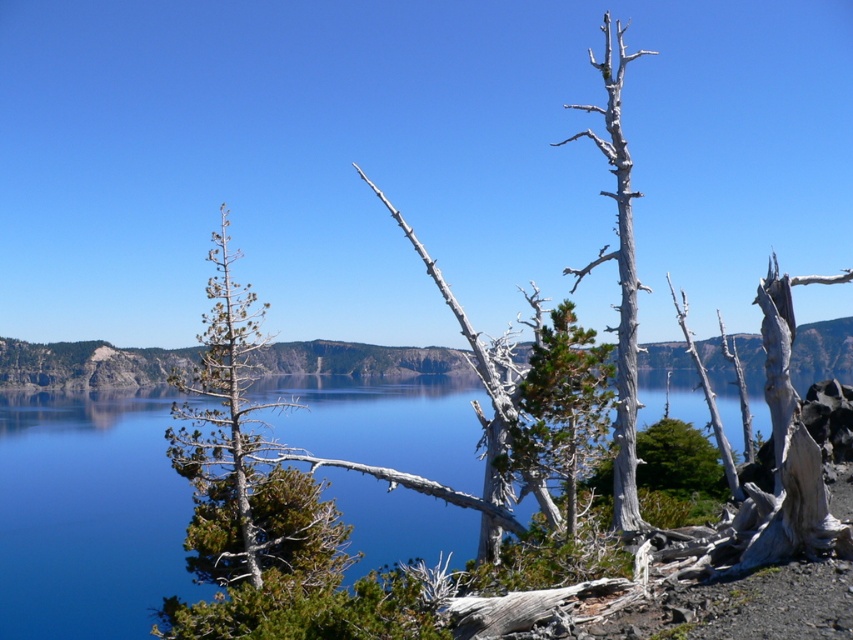
You are standing at the edge of the lake and want to take a photo of the green textured pine tree at left. If your camera has a maximum zoom range of 40 feet, will you need to move closer to the tree to capture it clearly?

The green textured pine tree at left is 48.45 feet from the camera, which exceeds the camera maximum zoom range of 40 feet. Therefore, you need to move closer to the tree to capture it clearly.

You are a hiker standing at the edge of the lake and want to know if the blue glassy water at center is higher or lower than the green textured pine tree at left. Based on the scene, can you determine which one is higher?

The blue glassy water at center is taller than green textured pine tree at left, so the water is higher than the tree.